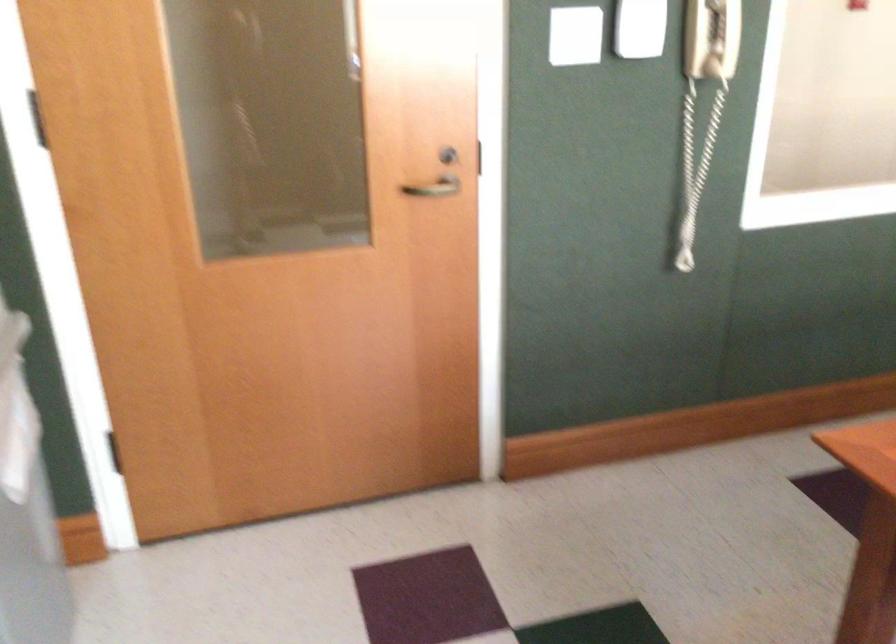
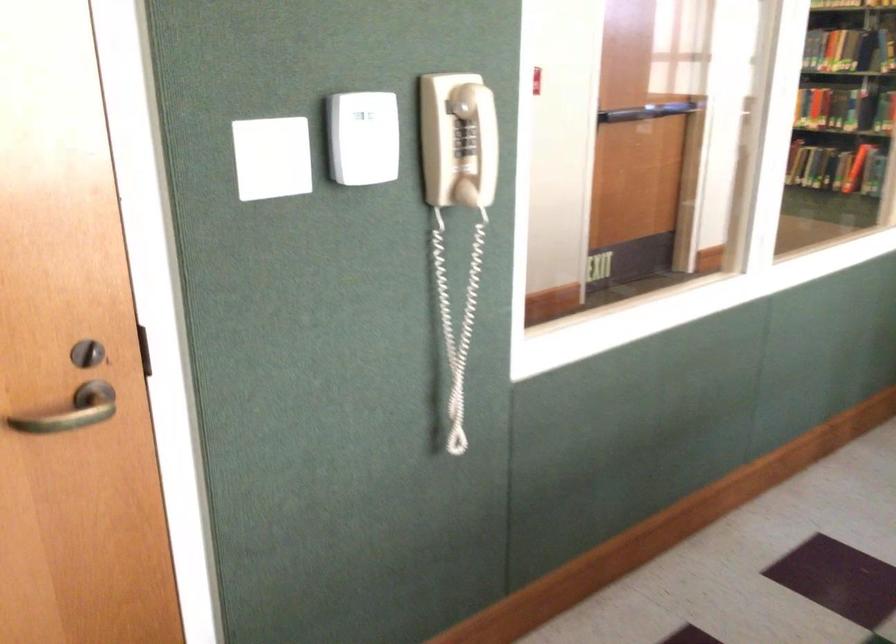
Question: The images are taken continuously from a first-person perspective. In which direction are you moving?

Choices:
 (A) Left
 (B) Right
 (C) Forward
 (D) Backward

Answer: (C)